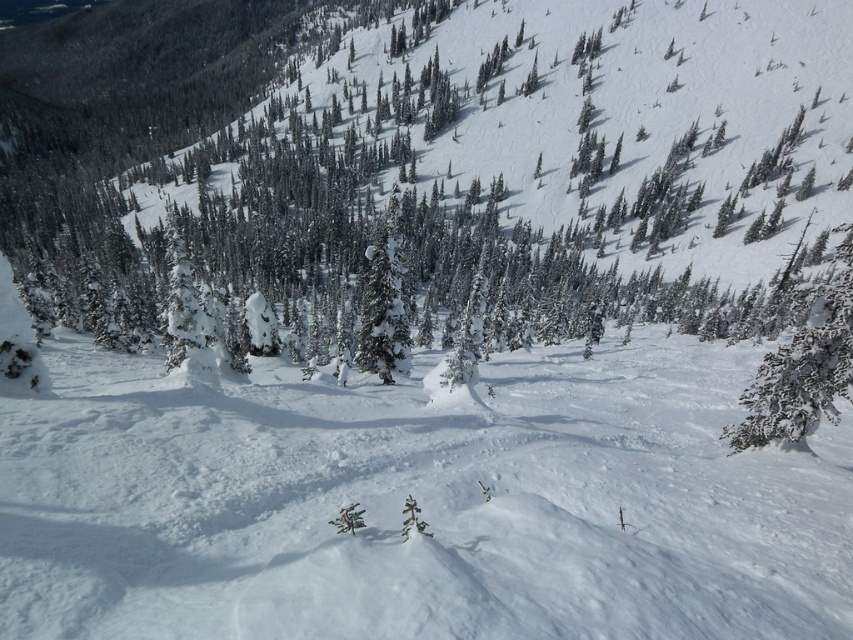
Question: Does snow-covered evergreen at lower right appear on the right side of snow-covered evergreen tree at center?

Choices:
 (A) no
 (B) yes

Answer: (B)

Question: Which point is closer to the camera taking this photo?

Choices:
 (A) (595, 458)
 (B) (384, 256)
 (C) (805, 420)

Answer: (A)

Question: Is snow-covered evergreen at lower right in front of snow-covered evergreen tree at center?

Choices:
 (A) no
 (B) yes

Answer: (B)

Question: Based on their relative distances, which object is nearer to the white snow at center?

Choices:
 (A) snow-covered evergreen tree at center
 (B) snow-covered evergreen at lower right

Answer: (B)

Question: Which of the following is the closest to the observer?

Choices:
 (A) (778, 355)
 (B) (276, 368)
 (C) (408, 333)

Answer: (A)

Question: Can you confirm if white snow at center is thinner than snow-covered evergreen tree at center?

Choices:
 (A) no
 (B) yes

Answer: (A)